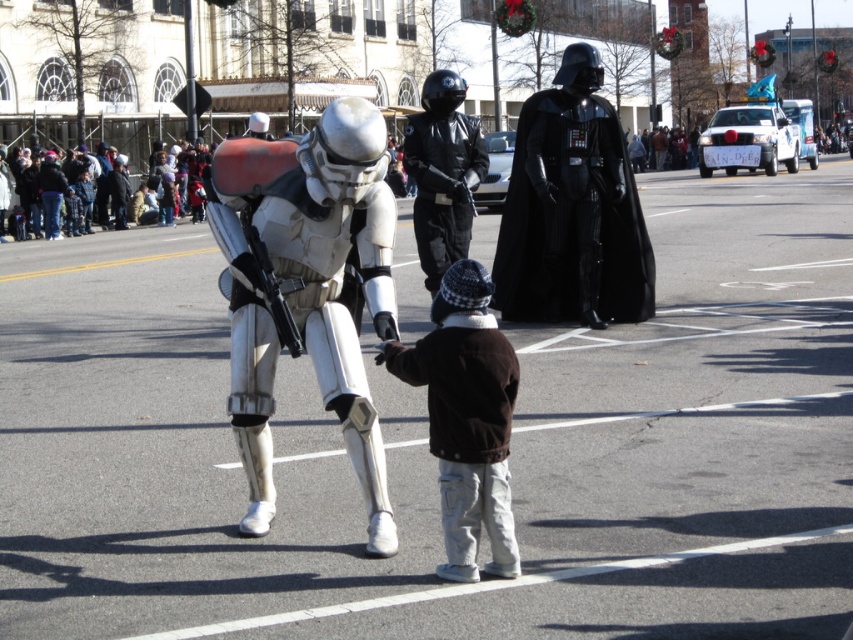
Question: Does brown fuzzy jacket at center have a smaller size compared to black leather jacket at center?

Choices:
 (A) yes
 (B) no

Answer: (A)

Question: Which point is farther to the camera?

Choices:
 (A) brown fuzzy jacket at center
 (B) white matte armor at center
 (C) black leather jacket at center

Answer: (C)

Question: From the image, what is the correct spatial relationship of white matte armor at center in relation to black matte/soft darth vader at center?

Choices:
 (A) below
 (B) above

Answer: (A)

Question: Which of the following is the farthest from the observer?

Choices:
 (A) white matte armor at center
 (B) brown fuzzy jacket at center
 (C) black leather jacket at center

Answer: (C)

Question: Which object is positioned closest to the black matte/soft darth vader at center?

Choices:
 (A) brown fuzzy jacket at center
 (B) black leather jacket at center

Answer: (B)

Question: Is black matte/soft darth vader at center to the left of brown fuzzy jacket at center from the viewer's perspective?

Choices:
 (A) yes
 (B) no

Answer: (B)